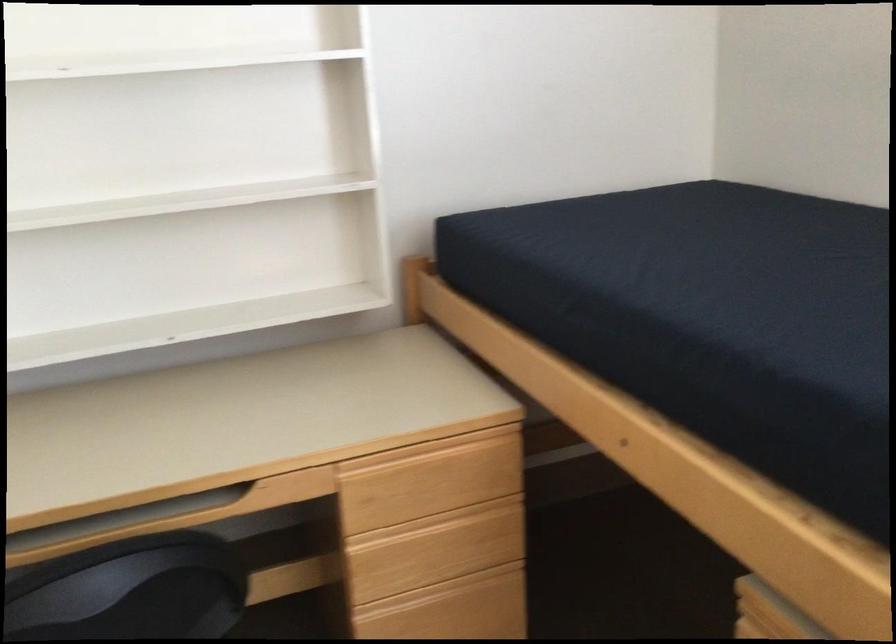
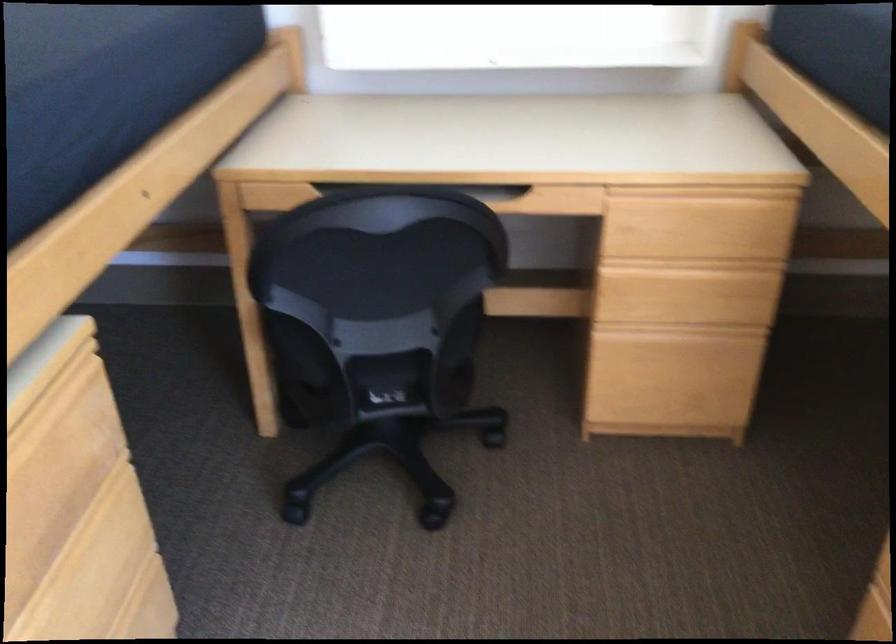
Question: The camera is either moving clockwise (left) or counter-clockwise (right) around the object. The first image is from the beginning of the video and the second image is from the end. Is the camera moving left or right when shooting the video?

Choices:
 (A) Left
 (B) Right

Answer: (B)